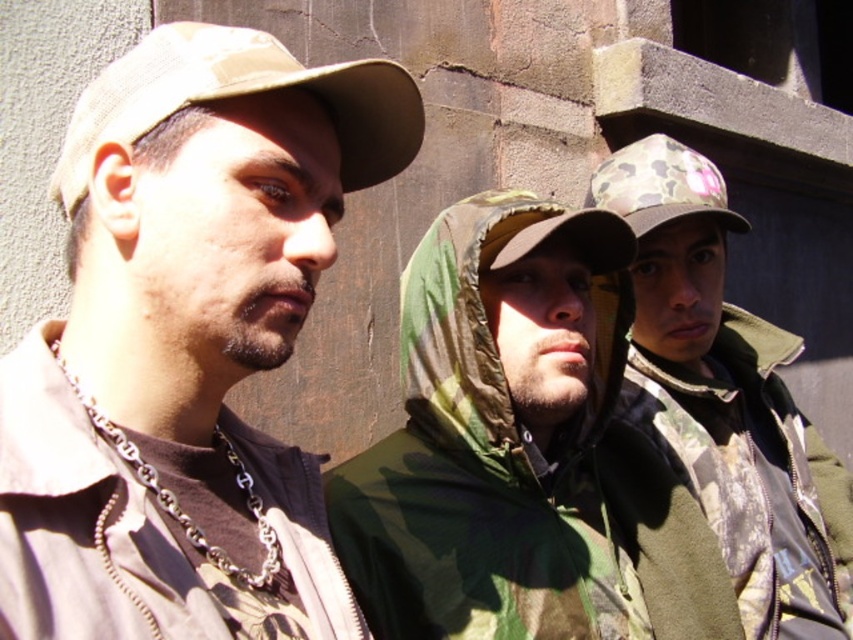
Question: Which object is the farthest from the matte khaki cap at center?

Choices:
 (A) camo fabric baseball cap at center
 (B) camouflage fabric jacket at center

Answer: (A)

Question: Is matte khaki cap at center to the left of camouflage fabric baseball cap at left from the viewer's perspective?

Choices:
 (A) yes
 (B) no

Answer: (A)

Question: Among these objects, which one is nearest to the camera?

Choices:
 (A) camouflage fabric baseball cap at left
 (B) camouflage fabric jacket at center
 (C) camo fabric jacket at center
 (D) camo fabric baseball cap at center

Answer: (A)

Question: Estimate the real-world distances between objects in this image. Which object is closer to the camo fabric jacket at center?

Choices:
 (A) camouflage fabric jacket at center
 (B) camo fabric baseball cap at center

Answer: (B)

Question: Is camouflage fabric jacket at center smaller than camo fabric jacket at center?

Choices:
 (A) no
 (B) yes

Answer: (B)

Question: Can you confirm if matte khaki cap at center is positioned to the right of camouflage fabric jacket at center?

Choices:
 (A) yes
 (B) no

Answer: (B)